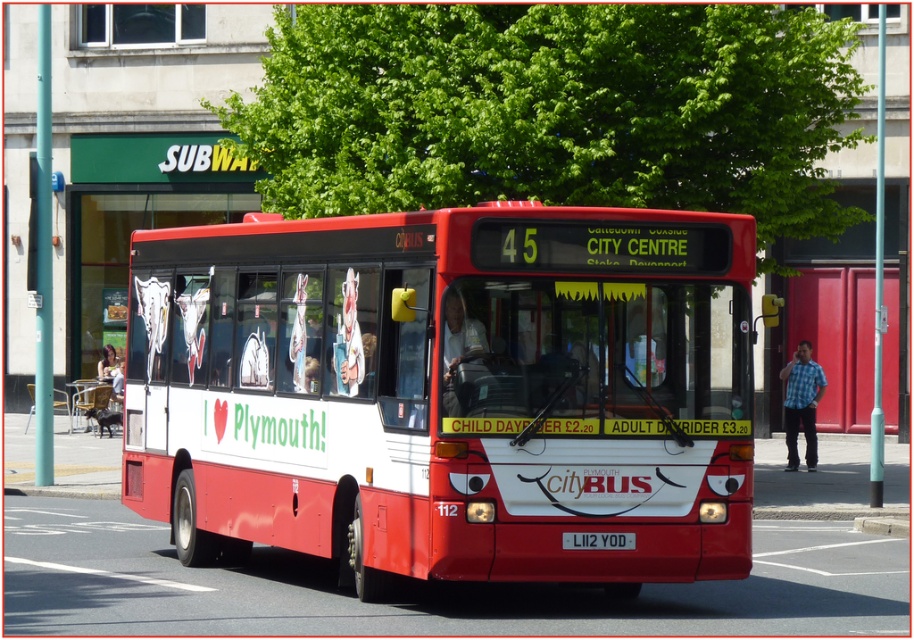
Question: Which object is positioned farthest from the blue plaid shirt at right?

Choices:
 (A) white plastic license plate at center
 (B) matte red bus at center

Answer: (A)

Question: Does matte red bus at center appear on the right side of blue plaid shirt at right?

Choices:
 (A) no
 (B) yes

Answer: (A)

Question: Can you confirm if matte red bus at center is positioned below white plastic license plate at center?

Choices:
 (A) yes
 (B) no

Answer: (B)

Question: Is matte red bus at center above blue plaid shirt at right?

Choices:
 (A) no
 (B) yes

Answer: (B)

Question: Estimate the real-world distances between objects in this image. Which object is farther from the matte red bus at center?

Choices:
 (A) blue plaid shirt at right
 (B) white plastic license plate at center

Answer: (A)

Question: Which of these objects is positioned closest to the white plastic license plate at center?

Choices:
 (A) matte red bus at center
 (B) blue plaid shirt at right

Answer: (A)